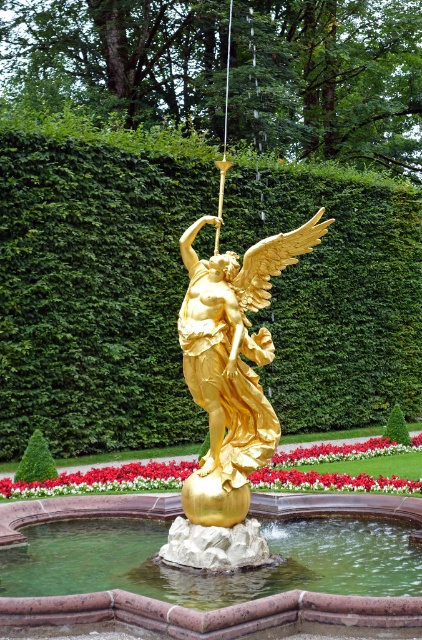
You are a gardener who needs to trim the green leafy hedge at center and the gold polished sphere at center. Which object is located above the other?

The green leafy hedge at center is positioned over the gold polished sphere at center.

You are standing at the center of the fountain and want to place a small golden flower pot exactly where the gold polished sphere at center is located. Can you determine the exact coordinates where you should place it?

The gold polished sphere at center is located at coordinates point (213, 612), so you should place the flower pot at those coordinates.

You are an art conservator assessing the fountain structure. You need to determine which object is shorter between the gold polished sphere at center and the gold polished statue at center. Which one is shorter?

The gold polished sphere at center is shorter than the gold polished statue at center.